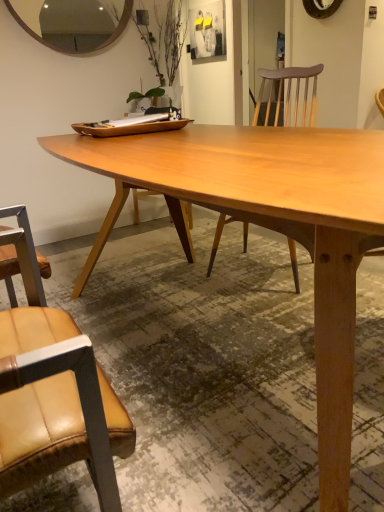
Describe the element at coordinates (273, 218) in the screenshot. This screenshot has height=512, width=384. I see `light brown wood table at center` at that location.

This screenshot has width=384, height=512. What do you see at coordinates (72, 22) in the screenshot?
I see `wooden mirror at upper left` at bounding box center [72, 22].

You are a GUI agent. You are given a task and a screenshot of the screen. Output one action in this format:
    pyautogui.click(x=<x>, y=<y>)
    Task: Click on the wooden mirror at upper left
    This screenshot has width=384, height=512.
    Given the screenshot: What is the action you would take?
    pyautogui.click(x=72, y=22)

Where is `light brown wood table at center`? Image resolution: width=384 pixels, height=512 pixels. light brown wood table at center is located at coordinates (273, 218).

Is leather at left oriented away from light brown wood table at center?

leather at left does not have its back to light brown wood table at center.

Is leather at left not near light brown wood table at center?

No.

Considering the relative sizes of light brown wood table at center and wooden mirror at upper left in the image provided, is light brown wood table at center taller than wooden mirror at upper left?

Correct, light brown wood table at center is much taller as wooden mirror at upper left.

Can we say light brown wood table at center lies outside wooden mirror at upper left?

Yes, light brown wood table at center is not within wooden mirror at upper left.

Does point (184, 192) lie behind point (117, 3)?

That is False.

Are light brown wood table at center and wooden mirror at upper left far apart?

Yes, light brown wood table at center is far from wooden mirror at upper left.

Looking at the image, does light brown wood table at center seem bigger or smaller compared to leather at left?

In the image, light brown wood table at center appears to be larger than leather at left.

Is light brown wood table at center far from leather at left?

Actually, light brown wood table at center and leather at left are a little close together.

Is light brown wood table at center taller than leather at left?

No.

From a real-world perspective, which is physically below, light brown wood table at center or leather at left?

In real-world perspective, light brown wood table at center is lower.

From the image's perspective, which one is positioned higher, wooden mirror at upper left or leather at left?

From the image's view, wooden mirror at upper left is above.

Can you confirm if wooden mirror at upper left is positioned to the left of leather at left?

Yes.

Based on the photo, considering the sizes of objects wooden mirror at upper left and leather at left in the image provided, who is smaller, wooden mirror at upper left or leather at left?

With smaller size is wooden mirror at upper left.

Find the location of `mirror that is on the left side of light brown wood table at center`. mirror that is on the left side of light brown wood table at center is located at coordinates (72, 22).

Can we say wooden mirror at upper left lies outside light brown wood table at center?

wooden mirror at upper left is positioned outside light brown wood table at center.

Who is taller, wooden mirror at upper left or light brown wood table at center?

With more height is light brown wood table at center.

Is wooden mirror at upper left in contact with light brown wood table at center?

No, wooden mirror at upper left is not with light brown wood table at center.

From a real-world perspective, is leather at left physically located above or below wooden mirror at upper left?

Clearly, from a real-world perspective, leather at left is below wooden mirror at upper left.

Which of these two, leather at left or wooden mirror at upper left, stands taller?

With more height is leather at left.

From the image's perspective, is leather at left located above or below wooden mirror at upper left?

leather at left is situated lower than wooden mirror at upper left in the image.

You are a GUI agent. You are given a task and a screenshot of the screen. Output one action in this format:
    pyautogui.click(x=<x>, y=<y>)
    Task: Click on the mirror on the left of leather at left
    This screenshot has height=512, width=384.
    Given the screenshot: What is the action you would take?
    pyautogui.click(x=72, y=22)

What are the coordinates of `desk that is under the leather at left (from a real-world perspective)` in the screenshot? It's located at (273, 218).

This screenshot has width=384, height=512. What are the coordinates of `mirror that appears above the light brown wood table at center (from the image's perspective)` in the screenshot? It's located at (72, 22).

Looking at the image, which one is located further to leather at left, wooden mirror at upper left or light brown wood table at center?

wooden mirror at upper left.

Looking at the image, which one is located further to light brown wood table at center, leather at left or wooden mirror at upper left?

wooden mirror at upper left.

Considering their positions, is light brown wood table at center positioned closer to leather at left than wooden mirror at upper left?

light brown wood table at center is closer to leather at left.

Considering their positions, is leather at left positioned closer to wooden mirror at upper left than light brown wood table at center?

light brown wood table at center.

Based on their spatial positions, is wooden mirror at upper left or leather at left closer to light brown wood table at center?

leather at left is positioned closer to the anchor light brown wood table at center.

Consider the image. From the image, which object appears to be farther from wooden mirror at upper left, light brown wood table at center or leather at left?

leather at left lies further to wooden mirror at upper left than the other object.

Image resolution: width=384 pixels, height=512 pixels. Find the location of `desk located between leather at left and wooden mirror at upper left in the depth direction`. desk located between leather at left and wooden mirror at upper left in the depth direction is located at coordinates (273, 218).